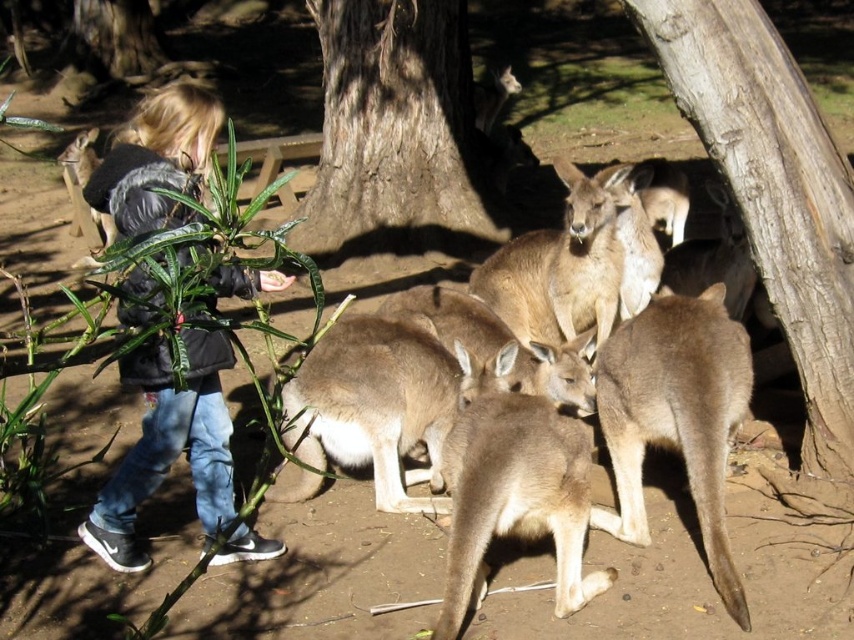
Question: Which point appears farthest from the camera in this image?

Choices:
 (A) (423, 394)
 (B) (237, 544)
 (C) (769, 106)
 (D) (314, 246)

Answer: (D)

Question: Does light brown fur at center come in front of smooth brown bark at upper right?

Choices:
 (A) no
 (B) yes

Answer: (A)

Question: Can you confirm if smooth brown bark at upper right is positioned to the right of brown rough bark tree at center?

Choices:
 (A) yes
 (B) no

Answer: (A)

Question: Among these objects, which one is farthest from the camera?

Choices:
 (A) brown rough bark tree at center
 (B) dark blue jeans at left
 (C) light brown fur at center

Answer: (A)

Question: Which object is positioned closest to the dark blue jeans at left?

Choices:
 (A) light brown fur at center
 (B) brown rough bark tree at center
 (C) smooth brown bark at upper right

Answer: (A)

Question: Is light brown fur at center smaller than brown rough bark tree at center?

Choices:
 (A) yes
 (B) no

Answer: (A)